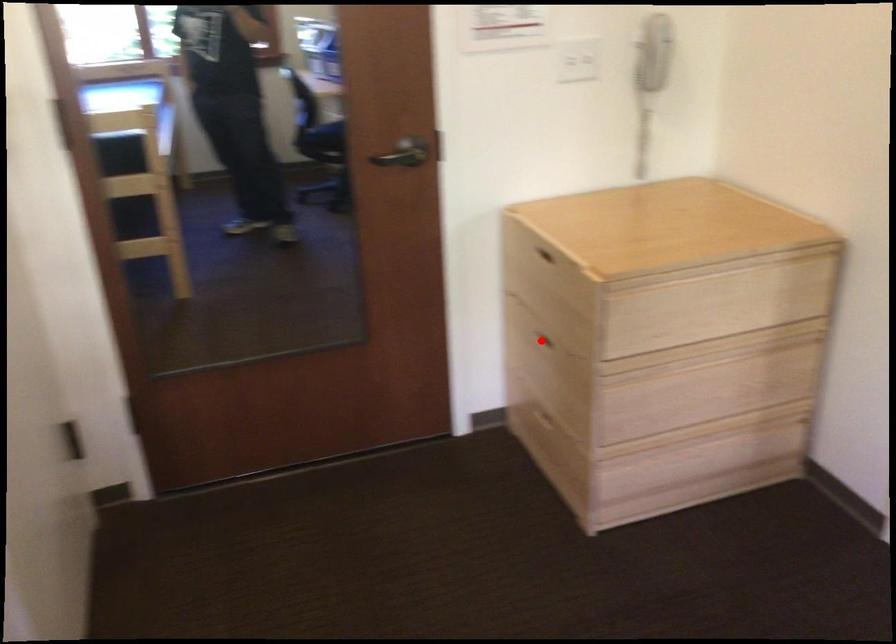
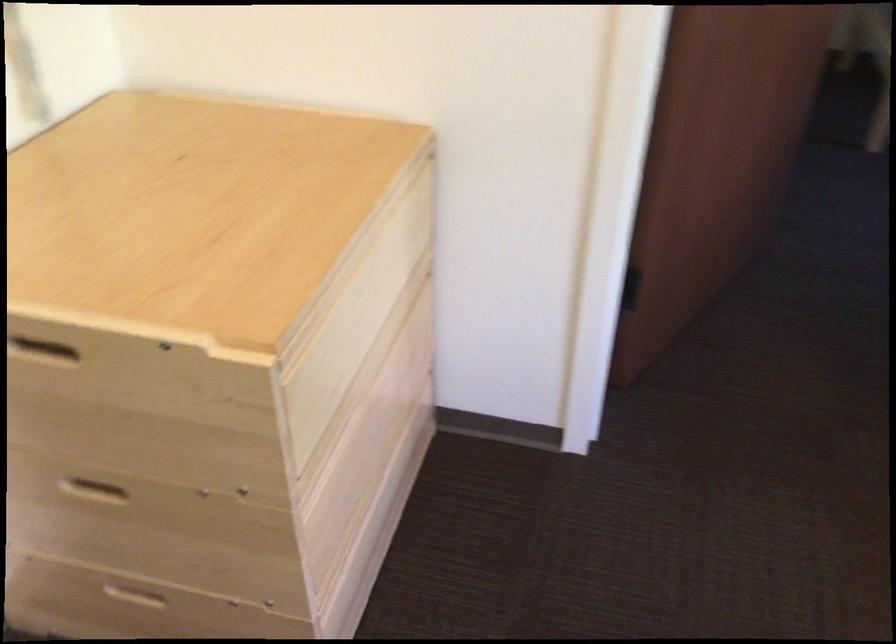
Question: I am providing you with two images of the same scene from different viewpoints. In image1, a red point is highlighted. Considering the same 3D point in image2, which of the following is correct?

Choices:
 (A) It is closer
 (B) It is farther

Answer: (A)